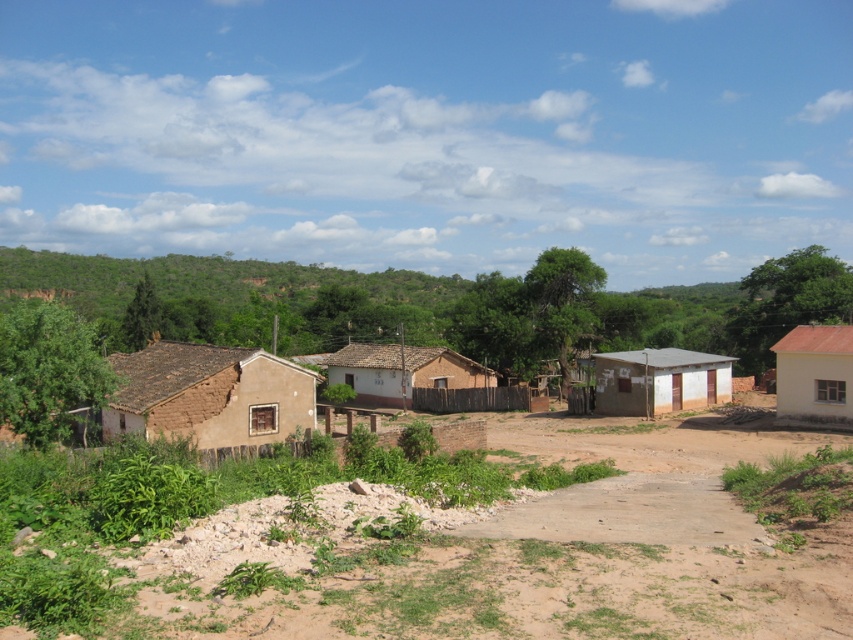
You are standing at the center of the dirt path in the rural scene. You need to locate the brown mud hut at left. According to the coordinates provided, where should you look relative to your position?

The brown mud hut at left is located at coordinates point (209, 394), which means it is positioned to the upper left relative to your central position on the dirt path.

You are standing at the dirt path in the rural scene. You notice two points marked in the image. Which point, point (631, 460) or point (828, 340), is closer to you?

Point (631, 460) is closer to the viewer than point (828, 340).

You are a traveler approaching the village and see the brown mud hut at left and the brown mud house at left. Which one is higher up in the image?

The brown mud hut at left is higher up in the image because it is positioned above the brown mud house at left.